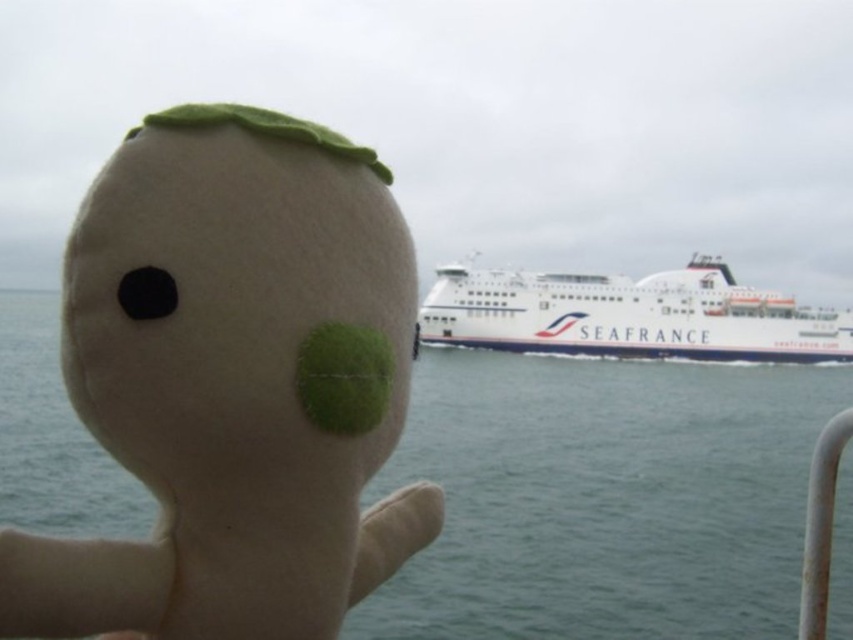
You are a photographer trying to capture both the felt toy at center and the white matte ferry at center in a single shot. Since the felt toy is closer, will it appear larger in the photo compared to the ferry?

The felt toy at center is thinner than the white matte ferry at center, so even though it is closer, its smaller physical size may make it appear similar in size or slightly smaller than the ferry in the photo.

You are standing in front of the image and want to determine which of the two points, point (347, 192) or point (45, 481), is nearer to you. Based on the scene description, which point is closer?

Point (347, 192) is closer to the viewer than point (45, 481).